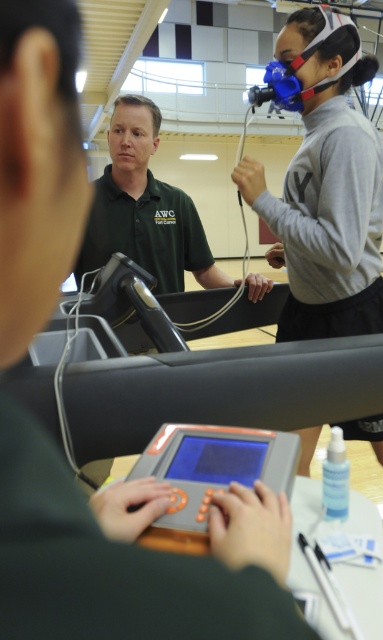
Question: Does blue rubber mask at upper center appear on the left side of gray plastic tablet at center?

Choices:
 (A) no
 (B) yes

Answer: (A)

Question: Which point appears closest to the camera in this image?

Choices:
 (A) (199, 500)
 (B) (142, 148)
 (C) (343, 248)

Answer: (A)

Question: Estimate the real-world distances between objects in this image. Which object is farther from the blue rubber mask at upper center?

Choices:
 (A) gray plastic tablet at center
 (B) green matte shirt at center

Answer: (A)

Question: Is blue rubber mask at upper center below green matte shirt at center?

Choices:
 (A) yes
 (B) no

Answer: (B)

Question: Does blue rubber mask at upper center appear under green matte shirt at center?

Choices:
 (A) yes
 (B) no

Answer: (B)

Question: Which object is positioned farthest from the blue rubber mask at upper center?

Choices:
 (A) green matte shirt at center
 (B) gray plastic tablet at center

Answer: (B)